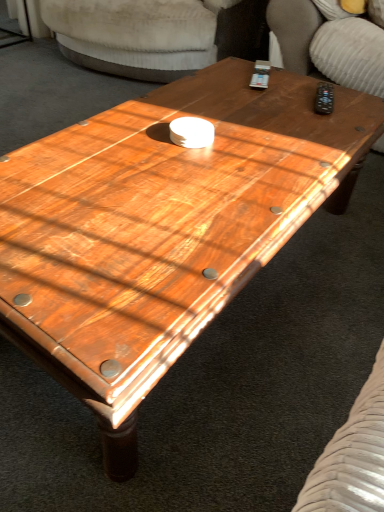
Question: In terms of height, does suede-like beige armchair at upper right, the second armchair from the left, look taller or shorter compared to velvet beige armchair at upper center, which ranks as the second armchair in right-to-left order?

Choices:
 (A) tall
 (B) short

Answer: (B)

Question: Relative to velvet beige armchair at upper center, which ranks as the second armchair in right-to-left order, is suede-like beige armchair at upper right, the second armchair from the left, in front or behind?

Choices:
 (A) front
 (B) behind

Answer: (A)

Question: Is point (339, 61) positioned closer to the camera than point (195, 0)?

Choices:
 (A) farther
 (B) closer

Answer: (B)

Question: Does point (x=119, y=10) appear closer or farther from the camera than point (x=360, y=62)?

Choices:
 (A) farther
 (B) closer

Answer: (A)

Question: In terms of height, does velvet beige armchair at upper center, the first armchair viewed from the left, look taller or shorter compared to suede-like beige armchair at upper right, placed as the 1th armchair when sorted from right to left?

Choices:
 (A) short
 (B) tall

Answer: (B)

Question: Is velvet beige armchair at upper center, the first armchair viewed from the left, inside the boundaries of suede-like beige armchair at upper right, placed as the 1th armchair when sorted from right to left, or outside?

Choices:
 (A) outside
 (B) inside

Answer: (A)

Question: In terms of width, does velvet beige armchair at upper center, the first armchair viewed from the left, look wider or thinner when compared to suede-like beige armchair at upper right, placed as the 1th armchair when sorted from right to left?

Choices:
 (A) wide
 (B) thin

Answer: (A)